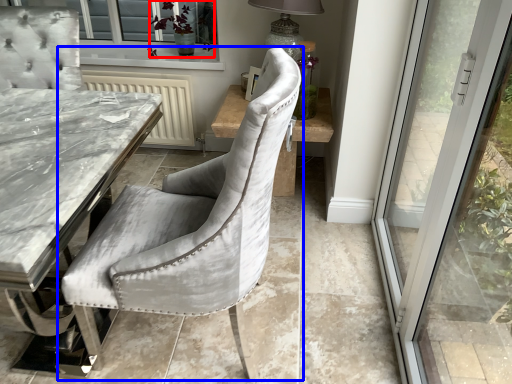
Question: Which object appears farthest to the camera in this image, plant (highlighted by a red box) or chair (highlighted by a blue box)?

Choices:
 (A) plant
 (B) chair

Answer: (A)